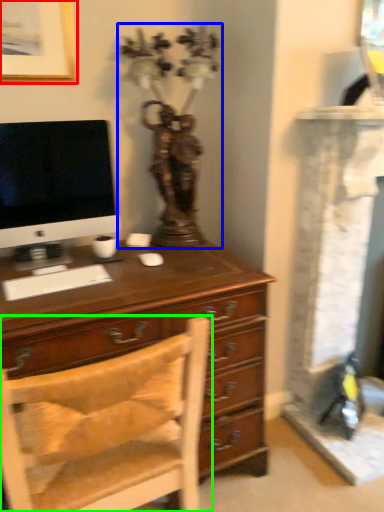
Question: Which object is positioned closest to picture frame (highlighted by a red box)? Select from antique (highlighted by a blue box) and chair (highlighted by a green box).

Choices:
 (A) antique
 (B) chair

Answer: (A)